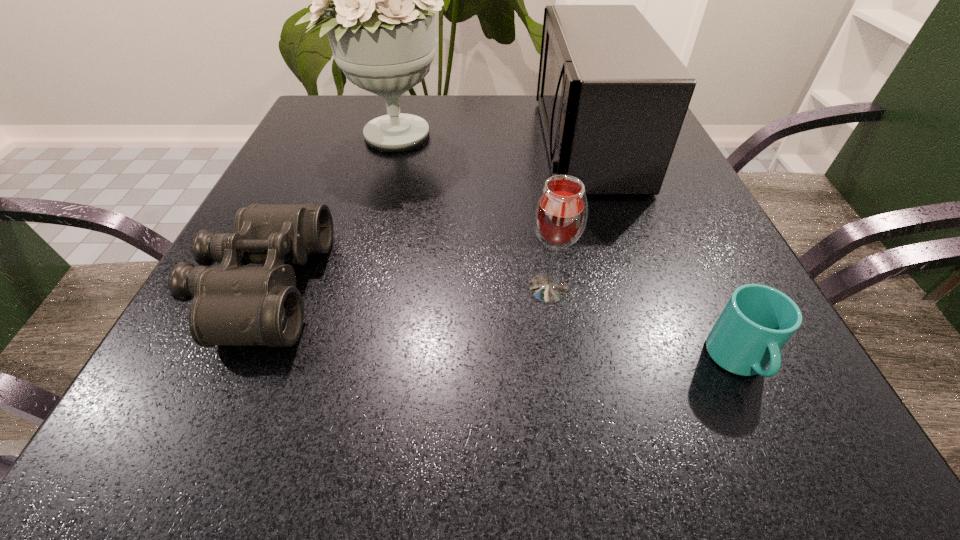
Find the location of a particular element. object present at the far right corner is located at coordinates (612, 95).

Identify the location of object situated at the near right corner. (757, 321).

This screenshot has height=540, width=960. Find the location of `vacant space at the near edge of the desktop`. vacant space at the near edge of the desktop is located at coordinates (276, 423).

This screenshot has height=540, width=960. In the image, there is a desktop. What are the coordinates of `vacant space at the left edge` in the screenshot? It's located at (292, 148).

Locate an element on the screen. Image resolution: width=960 pixels, height=540 pixels. blank space at the right edge of the desktop is located at coordinates (688, 394).

Locate an element on the screen. The image size is (960, 540). free space at the far left corner is located at coordinates (309, 112).

Locate an element on the screen. This screenshot has width=960, height=540. free space between the cup and the second tallest object is located at coordinates (662, 252).

Locate an element on the screen. The height and width of the screenshot is (540, 960). vacant space that's between the microwave_oven and the cup is located at coordinates [x=662, y=252].

Identify the location of unoccupied position between the tallest object and the second tallest object. [x=489, y=139].

Find the location of `free area in between the wineglass and the binoculars`. free area in between the wineglass and the binoculars is located at coordinates (405, 288).